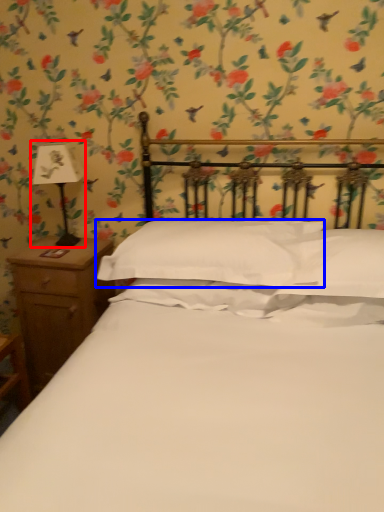
Question: Which point is further to the camera, bedside lamp (highlighted by a red box) or pillow (highlighted by a blue box)?

Choices:
 (A) bedside lamp
 (B) pillow

Answer: (A)